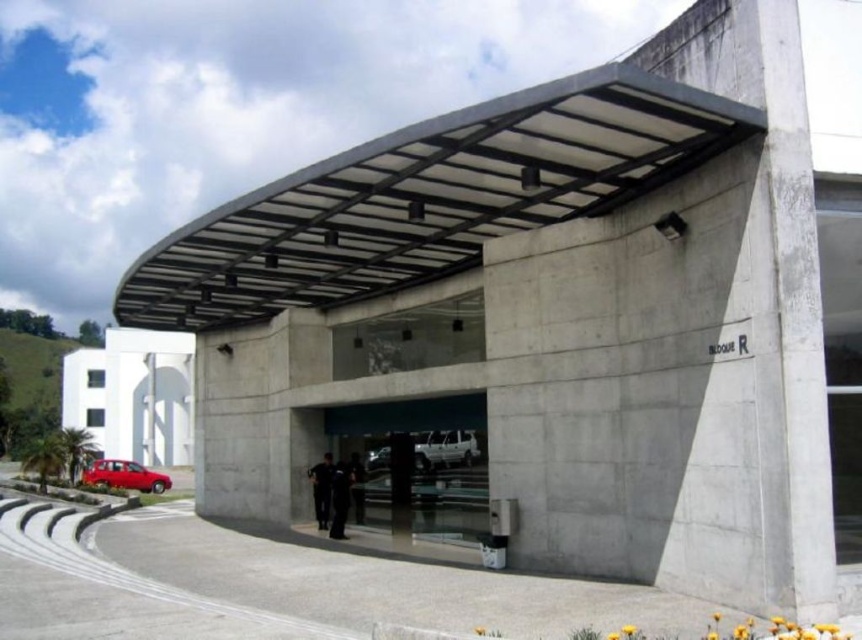
Question: Which object is farther from the camera taking this photo?

Choices:
 (A) white matte van at center
 (B) white concrete building at upper left

Answer: (B)

Question: Estimate the real-world distances between objects in this image. Which object is closer to the concrete/textured awning at center?

Choices:
 (A) black matte pants at center
 (B) white concrete building at upper left
 (C) shiny red car at lower left

Answer: (A)

Question: Can you confirm if white concrete building at upper left is bigger than shiny red car at lower left?

Choices:
 (A) no
 (B) yes

Answer: (B)

Question: Does concrete/textured awning at center appear on the right side of black matte uniform at center?

Choices:
 (A) yes
 (B) no

Answer: (B)

Question: Does white matte van at center have a smaller size compared to shiny red car at lower left?

Choices:
 (A) no
 (B) yes

Answer: (B)

Question: Among these objects, which one is nearest to the camera?

Choices:
 (A) concrete/textured awning at center
 (B) white concrete building at upper left
 (C) black matte jacket at center

Answer: (A)